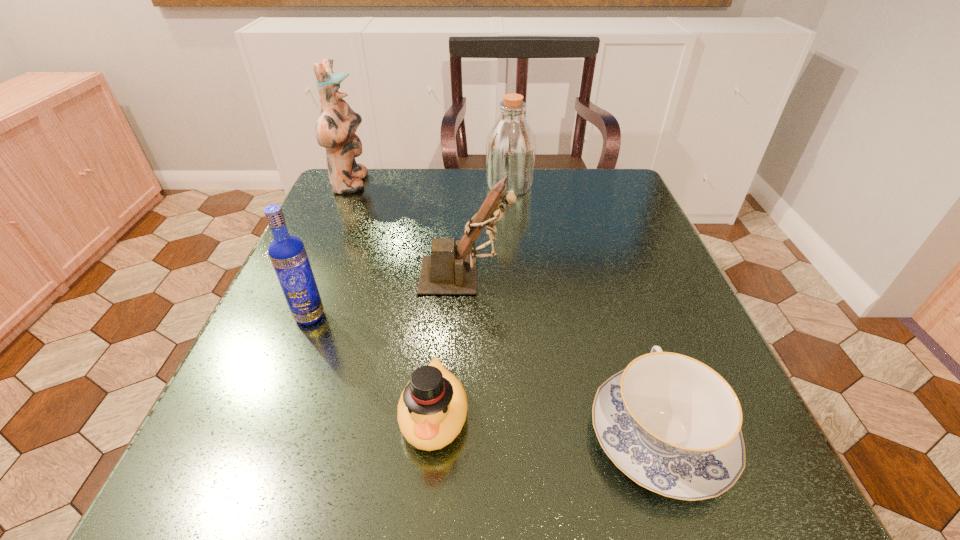
Locate an element on the screen. The height and width of the screenshot is (540, 960). figurine at the left edge is located at coordinates (335, 129).

In order to click on vodka that is positioned at the left edge in this screenshot , I will do `click(288, 255)`.

The width and height of the screenshot is (960, 540). Identify the location of object situated at the right edge. (672, 424).

This screenshot has width=960, height=540. In order to click on object that is at the far left corner in this screenshot , I will do `click(335, 129)`.

Locate an element on the screen. Image resolution: width=960 pixels, height=540 pixels. object that is positioned at the near right corner is located at coordinates (672, 424).

Where is `free region at the far edge`? This screenshot has width=960, height=540. free region at the far edge is located at coordinates (463, 195).

The width and height of the screenshot is (960, 540). Find the location of `vacant space at the near edge of the desktop`. vacant space at the near edge of the desktop is located at coordinates [564, 463].

Locate an element on the screen. The width and height of the screenshot is (960, 540). free location at the left edge is located at coordinates (238, 379).

Identify the location of vacant space at the right edge. (604, 302).

At what (x,y) coordinates should I click in order to perform the action: click on free region at the far left corner of the desktop. Please return your answer as a coordinate pair (x, y). Looking at the image, I should click on (357, 215).